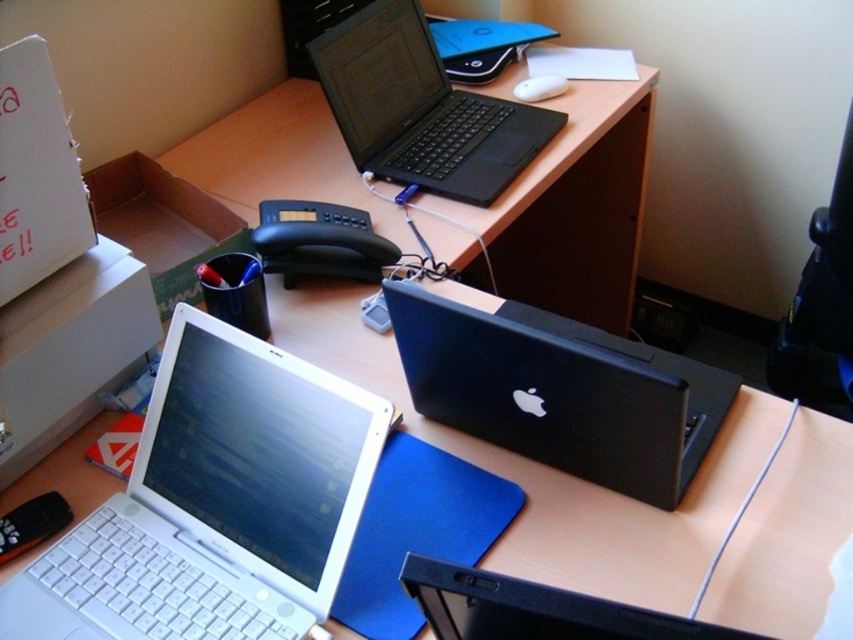
Can you confirm if white plastic laptop at lower left is positioned to the right of black matte laptop at center?

Incorrect, white plastic laptop at lower left is not on the right side of black matte laptop at center.

Measure the distance between white plastic laptop at lower left and black matte laptop at center.

A distance of 11.15 inches exists between white plastic laptop at lower left and black matte laptop at center.

The width and height of the screenshot is (853, 640). I want to click on white plastic laptop at lower left, so (215, 502).

I want to click on white plastic laptop at lower left, so click(215, 502).

What do you see at coordinates (215, 502) in the screenshot? I see `white plastic laptop at lower left` at bounding box center [215, 502].

Does white plastic laptop at lower left have a greater width compared to black matte laptop at lower center?

Yes, white plastic laptop at lower left is wider than black matte laptop at lower center.

Is point (97, 620) positioned before point (515, 584)?

No, it is not.

Locate an element on the screen. The height and width of the screenshot is (640, 853). white plastic laptop at lower left is located at coordinates (215, 502).

What do you see at coordinates (560, 392) in the screenshot?
I see `black matte laptop at center` at bounding box center [560, 392].

You are a GUI agent. You are given a task and a screenshot of the screen. Output one action in this format:
    pyautogui.click(x=<x>, y=<y>)
    Task: Click on the black matte laptop at center
    
    Given the screenshot: What is the action you would take?
    pyautogui.click(x=560, y=392)